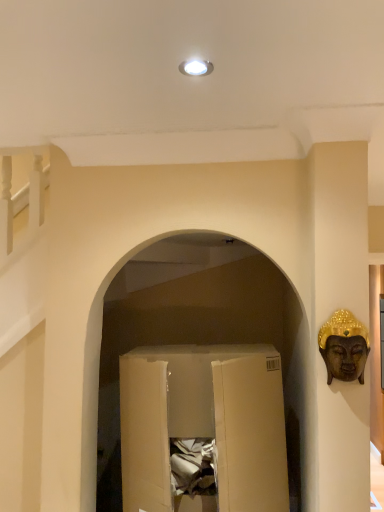
Describe the element at coordinates (204, 423) in the screenshot. The height and width of the screenshot is (512, 384). I see `cardboard box at center` at that location.

Identify the location of cardboard box at center. (204, 423).

Measure the distance between gold textured buddha head at right and camera.

3.89 feet.

Where is `gold textured buddha head at right`? The height and width of the screenshot is (512, 384). gold textured buddha head at right is located at coordinates (344, 347).

What do you see at coordinates (344, 347) in the screenshot?
I see `gold textured buddha head at right` at bounding box center [344, 347].

This screenshot has height=512, width=384. What are the coordinates of `cardboard box at center` in the screenshot? It's located at (204, 423).

Is cardboard box at center to the left or to the right of gold textured buddha head at right in the image?

In the image, cardboard box at center appears on the left side of gold textured buddha head at right.

In the image, is cardboard box at center positioned in front of or behind gold textured buddha head at right?

In the image, cardboard box at center appears behind gold textured buddha head at right.

Which point is more forward, (x=256, y=384) or (x=347, y=378)?

Positioned in front is point (x=347, y=378).

From the image's perspective, does cardboard box at center appear higher than gold textured buddha head at right?

No, from the image's perspective, cardboard box at center is not above gold textured buddha head at right.

From a real-world perspective, does cardboard box at center stand above gold textured buddha head at right?

No.

Between cardboard box at center and gold textured buddha head at right, which one has smaller width?

With smaller width is gold textured buddha head at right.

From their relative heights in the image, would you say cardboard box at center is taller or shorter than gold textured buddha head at right?

Clearly, cardboard box at center is taller compared to gold textured buddha head at right.

Which of these two, cardboard box at center or gold textured buddha head at right, is smaller?

With smaller size is gold textured buddha head at right.

Is cardboard box at center completely or partially outside of gold textured buddha head at right?

That's correct, cardboard box at center is outside of gold textured buddha head at right.

Is cardboard box at center in contact with gold textured buddha head at right?

There is a gap between cardboard box at center and gold textured buddha head at right.

Could you tell me if cardboard box at center is turned towards gold textured buddha head at right?

No, cardboard box at center is not turned towards gold textured buddha head at right.

How many degrees apart are the facing directions of cardboard box at center and gold textured buddha head at right?

3.39 degrees separate the facing orientations of cardboard box at center and gold textured buddha head at right.

Locate an element on the screen. The image size is (384, 512). person in front of the cardboard box at center is located at coordinates (344, 347).

Which is more to the right, gold textured buddha head at right or cardboard box at center?

Positioned to the right is gold textured buddha head at right.

Considering their positions, is gold textured buddha head at right located in front of or behind cardboard box at center?

Clearly, gold textured buddha head at right is in front of cardboard box at center.

Considering the points (350, 362) and (128, 405), which point is in front, point (350, 362) or point (128, 405)?

The point (350, 362) is in front.

From the image's perspective, relative to cardboard box at center, is gold textured buddha head at right above or below?

gold textured buddha head at right is situated higher than cardboard box at center in the image.

From a real-world perspective, who is located lower, gold textured buddha head at right or cardboard box at center?

cardboard box at center, from a real-world perspective.

Consider the image. Is gold textured buddha head at right wider than cardboard box at center?

In fact, gold textured buddha head at right might be narrower than cardboard box at center.

Based on the photo, is gold textured buddha head at right taller or shorter than cardboard box at center?

Considering their sizes, gold textured buddha head at right has less height than cardboard box at center.

Is gold textured buddha head at right bigger or smaller than cardboard box at center?

Considering their sizes, gold textured buddha head at right takes up less space than cardboard box at center.

Is gold textured buddha head at right inside or outside of cardboard box at center?

gold textured buddha head at right is located beyond the bounds of cardboard box at center.

Consider the image. Are gold textured buddha head at right and cardboard box at center making contact?

gold textured buddha head at right and cardboard box at center are not in contact.

Is cardboard box at center at the back of gold textured buddha head at right?

That's not correct — gold textured buddha head at right is not looking away from cardboard box at center.

How much distance is there between gold textured buddha head at right and cardboard box at center?

gold textured buddha head at right is 18.98 inches from cardboard box at center.

Where is `wide on the left of gold textured buddha head at right`? Image resolution: width=384 pixels, height=512 pixels. wide on the left of gold textured buddha head at right is located at coordinates (204, 423).

Locate an element on the screen. person in front of the cardboard box at center is located at coordinates (344, 347).

In order to click on wide lying on the left of gold textured buddha head at right in this screenshot , I will do `click(204, 423)`.